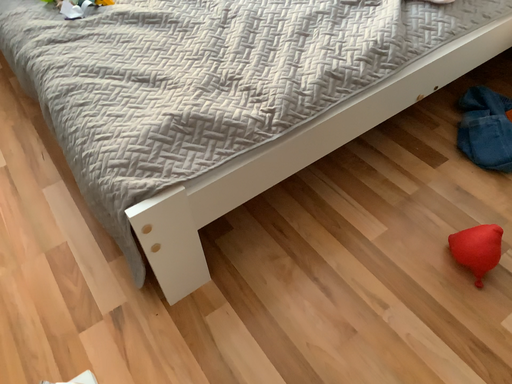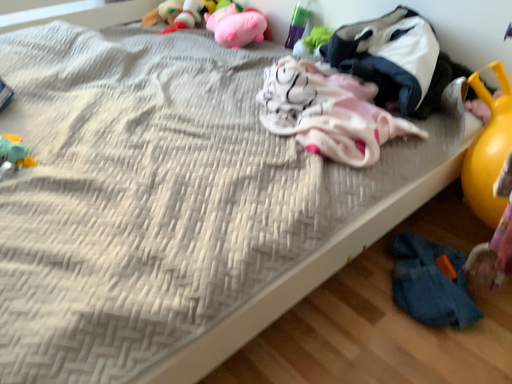
Question: Which way did the camera rotate in the video?

Choices:
 (A) rotated left
 (B) rotated right

Answer: (B)